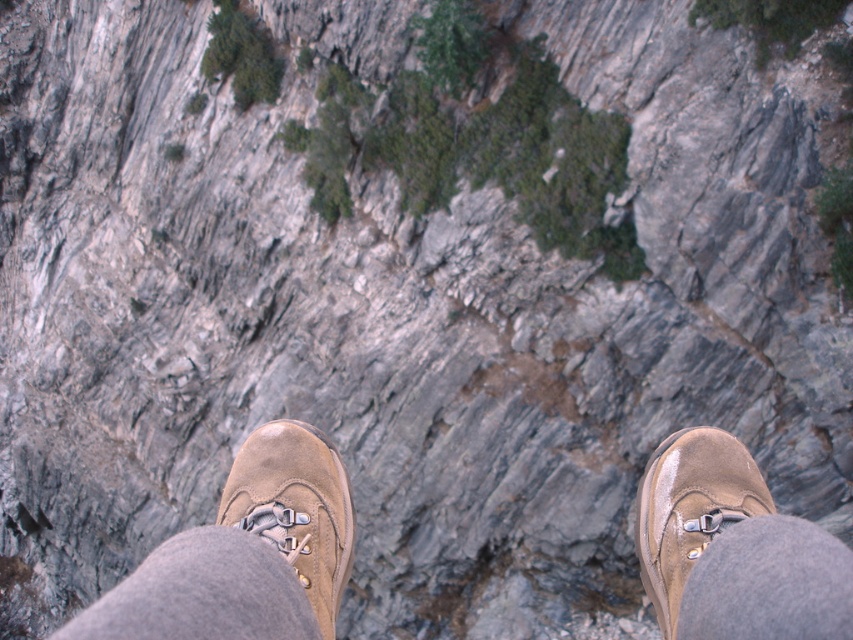
You are a hiker who needs to place a 3 meter long safety rope between your current position and the brown suede shoes at center. Is the distance sufficient?

The brown suede shoes at center is 2.94 meters from viewer, so the 3 meter long safety rope is sufficient to reach between the current position and the brown suede shoes at center.

You are a hiker trying to place your boots carefully on the rocky cliff. You notice two brown suede shoes in your view. Which one is closer to you, the brown suede shoes at center or the brown suede shoe at lower right?

The brown suede shoes at center is closer to you because it is positioned in front of the brown suede shoe at lower right.

You are standing at the edge of a rocky cliff. Your camera is positioned to capture a closeup of your boots. If you want to take a photo of the point at coordinates (306,454), which is 6.34 meters away from the camera, will you need to adjust the camera focus to ensure clarity?

The point at coordinates (306,454) is 6.34 meters away from the camera. Since the camera is already focused on the boots which are at the edge of the cliff where you are standing, adjusting the focus may be necessary because the point is further away than your boots. However, without knowing the current focus distance of the camera, it is difficult to determine if an adjustment is needed.